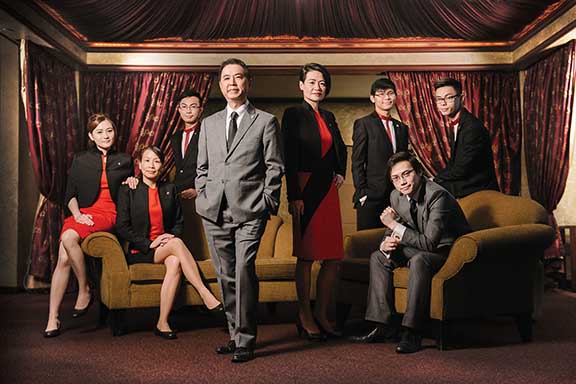
This screenshot has height=384, width=576. What are the coordinates of `maroon curtains` in the screenshot? It's located at (49, 116), (109, 99), (168, 90), (420, 98), (503, 98), (553, 98).